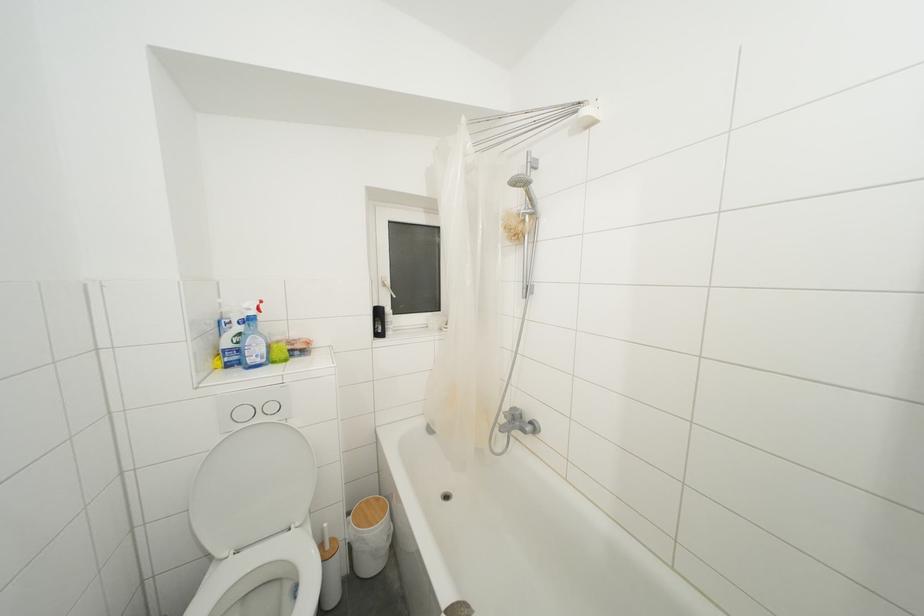
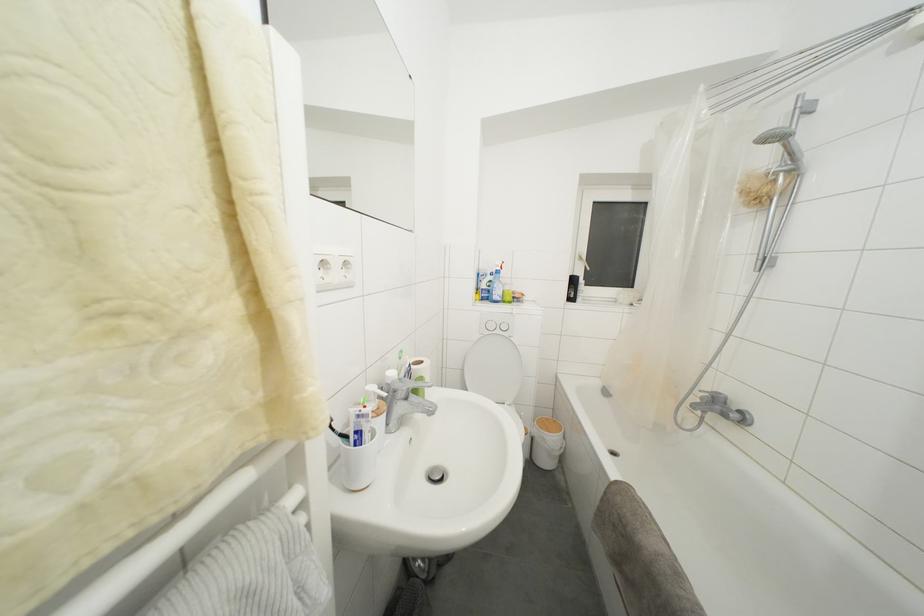
The point at (359,551) is marked in the first image. Where is the corresponding point in the second image?

(541, 445)